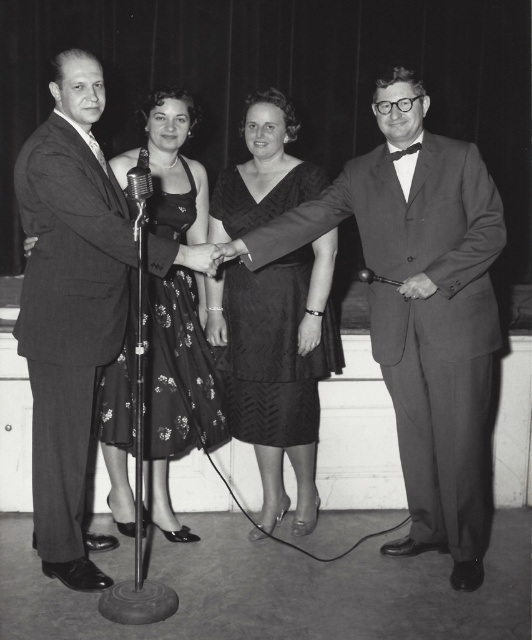
You are organizing a photo exhibition and need to determine the spatial relationship between the matte black suit at right and the black textured dress at center. Based on the image, which object occupies more horizontal space in the frame?

The matte black suit at right might be wider than black textured dress at center according to the description.

You are an event planner organizing a seating arrangement for a formal dinner. You need to decide where to place the matte black suit at left and the black textured dress at center based on their heights. Which person should sit at the center table where taller individuals are preferred?

The matte black suit at left has a greater height compared to the black textured dress at center, so the matte black suit at left should be seated at the center table where taller individuals are preferred.